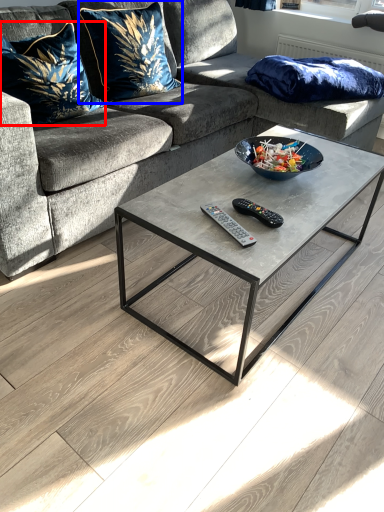
Question: Which of the following is the farthest to the observer, pillow (highlighted by a red box) or pillow (highlighted by a blue box)?

Choices:
 (A) pillow
 (B) pillow

Answer: (B)